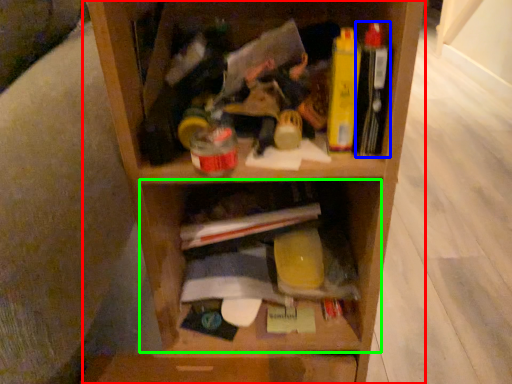
Question: Based on their relative distances, which object is nearer to shelf (highlighted by a red box)? Choose from book (highlighted by a blue box) and cabinet (highlighted by a green box).

Choices:
 (A) book
 (B) cabinet

Answer: (B)